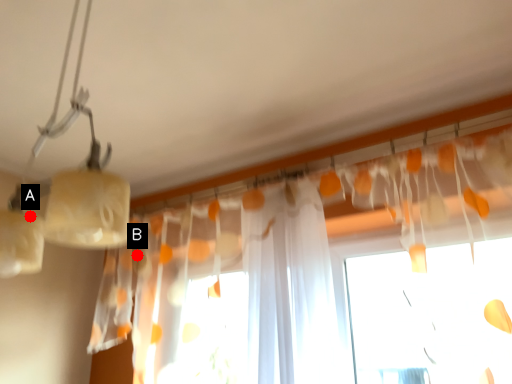
Question: Two points are circled on the image, labeled by A and B beside each circle. Which point is closer to the camera?

Choices:
 (A) A is closer
 (B) B is closer

Answer: (A)